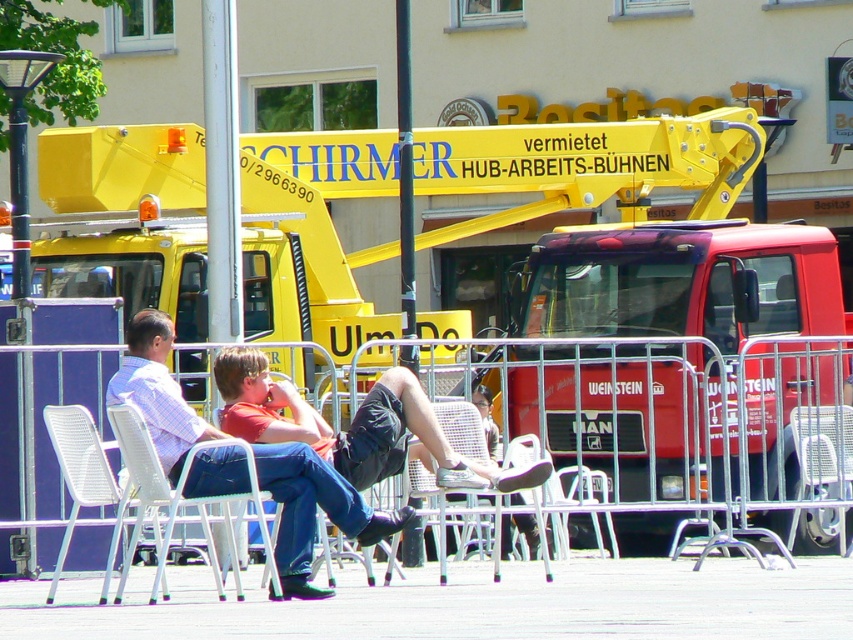
What is located at the coordinates point (590, 164) in the image?

The yellow metallic fire truck at center is located at point (590, 164).

You are a pedestrian standing on the paved area between the yellow metallic fire truck at center and the white plastic chair at center. Which object is closer to you?

The white plastic chair at center is closer to you because the yellow metallic fire truck at center is positioned on the right side of it, meaning the chair is between you and the fire truck.

You are standing at the point with coordinates (x=173, y=502) in the image. Based on the scene description, what object are you most likely standing on?

The point at coordinates (x=173, y=502) corresponds to the white plastic chair at lower left, so you are most likely standing on the white plastic chair at lower left.